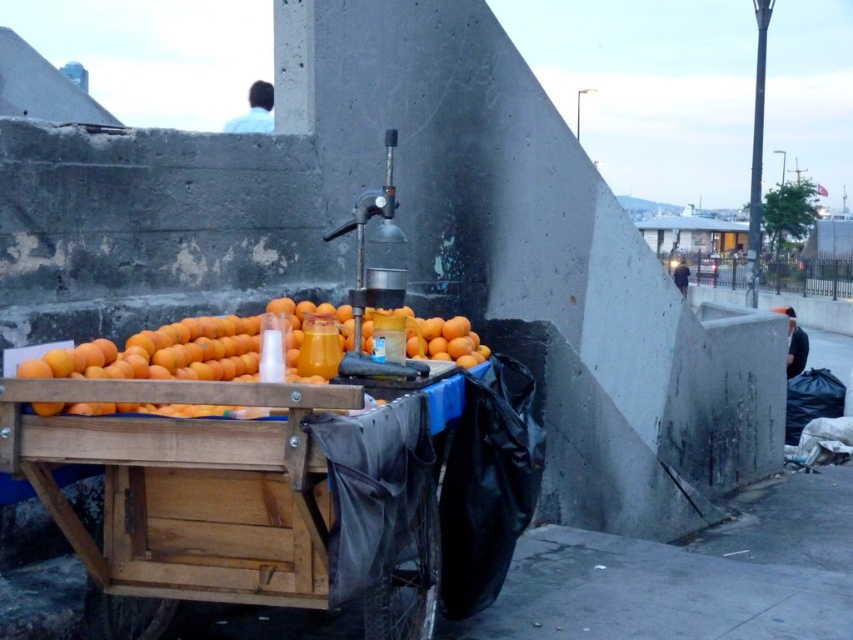
You are a delivery person who needs to place a package between the wooden cart at lower left and the dark blue fabric at right. The package requires a space of 6 meters. Can you fit the package between them?

The distance between the wooden cart at lower left and dark blue fabric at right is 6.68 meters, so yes, the package can be placed between them as there is enough space.

You are a customer looking at the orange matte at center and the light blue shirt at upper center. Which object is smaller in size?

The orange matte at center is smaller in size compared to the light blue shirt at upper center.